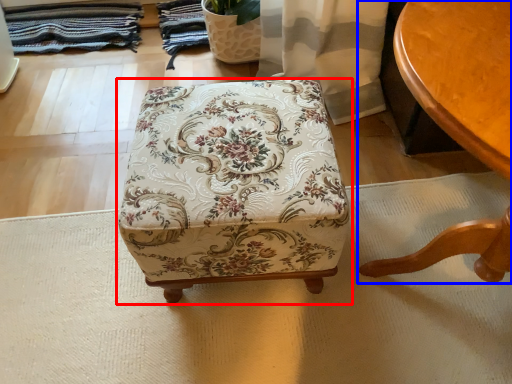
Question: Which of the following is the farthest to the observer, furniture (highlighted by a red box) or table (highlighted by a blue box)?

Choices:
 (A) furniture
 (B) table

Answer: (A)